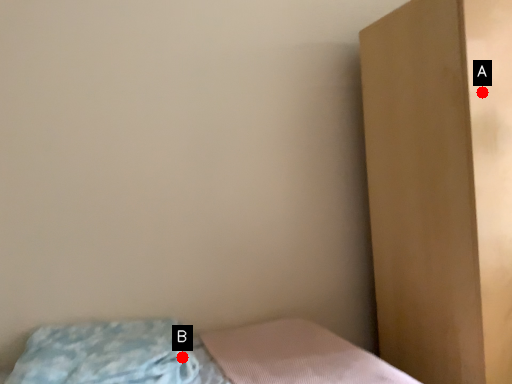
Question: Two points are circled on the image, labeled by A and B beside each circle. Among these points, which one is farthest from the camera?

Choices:
 (A) A is further
 (B) B is further

Answer: (A)